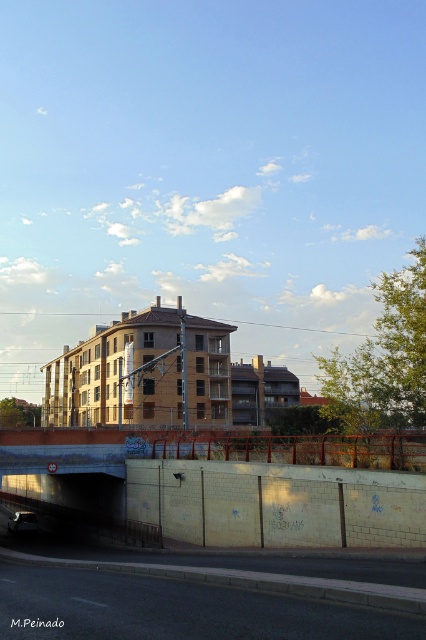
You are a delivery driver navigating a route and need to drop off a package at a specific location marked by a point on the map. The point is labeled as point (178, 608). According to the scene, where is this point located?

The point (178, 608) is located on the black asphalt highway at lower left.

You are a pedestrian standing on the sidewalk. You see the black asphalt highway at lower left and the shiny silver car at lower left. Which object is higher in elevation?

The black asphalt highway at lower left is above the shiny silver car at lower left, so it has a higher elevation.

You are standing at the center of the image and want to walk to the black asphalt highway at lower left. In which direction should you move relative to your current position?

To reach the black asphalt highway at lower left from the center of the image, you should move towards the lower left direction since its 2D location is at point (178,608).